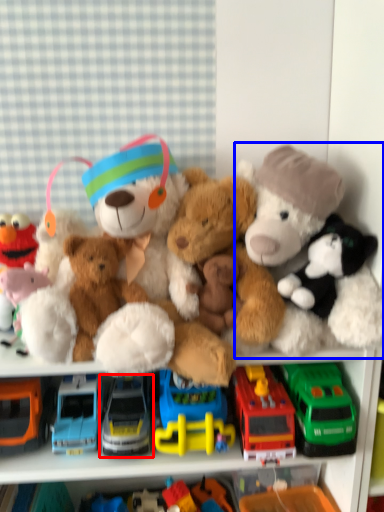
Question: Among these objects, which one is nearest to the camera, truck (highlighted by a red box) or toy (highlighted by a blue box)?

Choices:
 (A) truck
 (B) toy

Answer: (B)